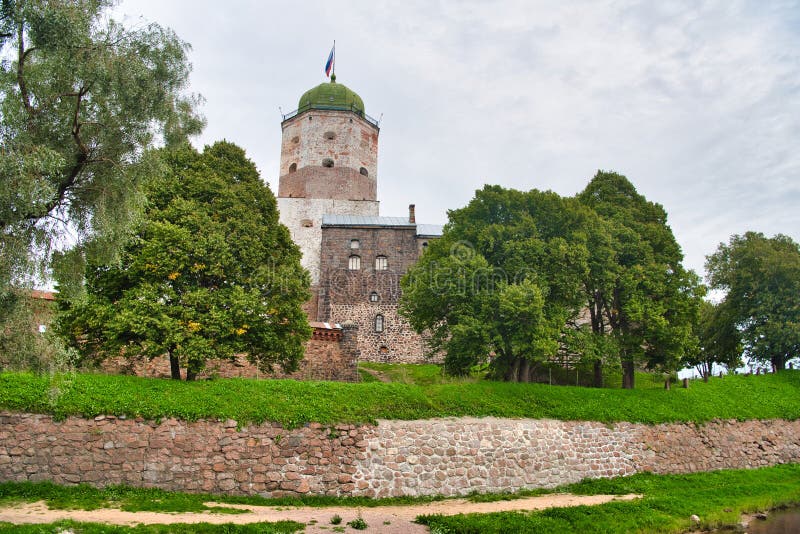
Find the location of a particular element. window is located at coordinates (354, 262).